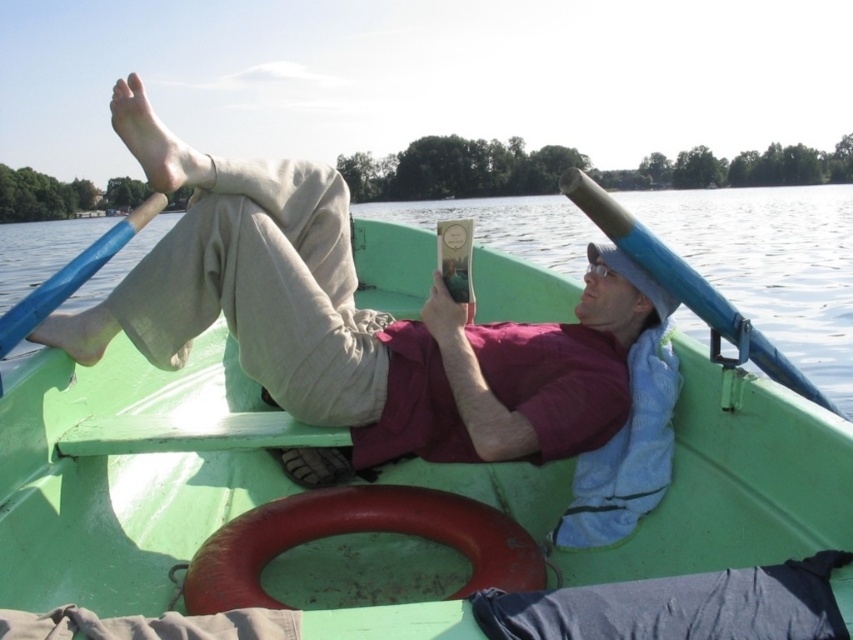
Is point (219, 436) farther from viewer compared to point (312, 314)?

That is False.

This screenshot has height=640, width=853. I want to click on green matte boat at center, so click(x=126, y=472).

The height and width of the screenshot is (640, 853). In order to click on green matte boat at center in this screenshot , I will do pos(126,472).